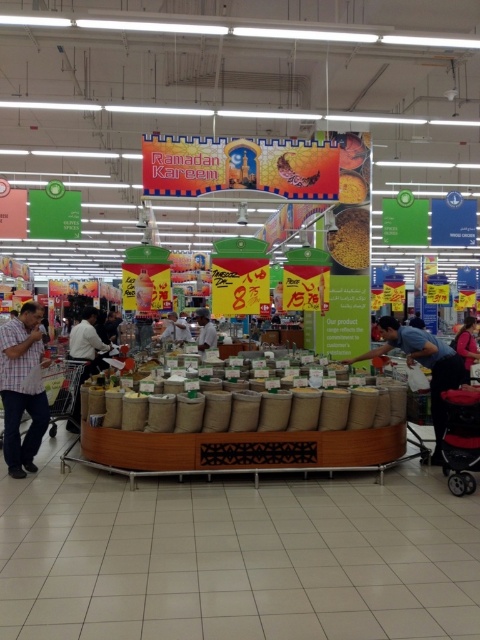
From the picture: Between yellow matte spice at center and white shirt at center, which one is positioned lower?

white shirt at center is lower down.

Which is in front, point (360, 250) or point (83, 323)?

Point (83, 323) is more forward.

This screenshot has width=480, height=640. Find the location of `yellow matte spice at center`. yellow matte spice at center is located at coordinates pyautogui.click(x=350, y=237).

Is point (343, 212) more distant than point (202, 342)?

No, (343, 212) is closer to viewer.

Which is behind, point (358, 269) or point (203, 340)?

Point (203, 340)

The image size is (480, 640). I want to click on yellow matte spice at center, so click(x=350, y=237).

I want to click on blue fabric shirt at center, so click(x=422, y=365).

Does blue fabric shirt at center have a larger size compared to white shirt at center?

No.

Who is more forward, (430, 390) or (95, 346)?

Point (430, 390)

This screenshot has width=480, height=640. I want to click on blue fabric shirt at center, so click(422, 365).